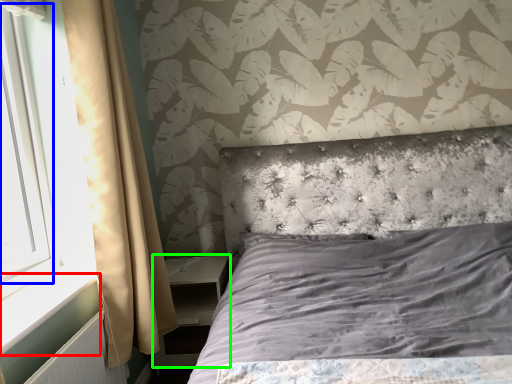
Question: Which is farther away from window sill (highlighted by a red box)? window screen (highlighted by a blue box) or nightstand (highlighted by a green box)?

Choices:
 (A) window screen
 (B) nightstand

Answer: (B)